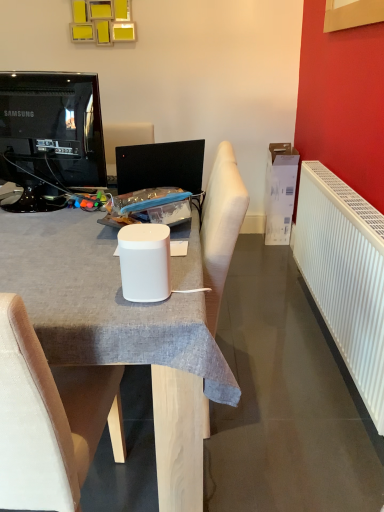
This screenshot has width=384, height=512. Find the location of `vacant space situated on the left part of white matte speaker at center`. vacant space situated on the left part of white matte speaker at center is located at coordinates (77, 292).